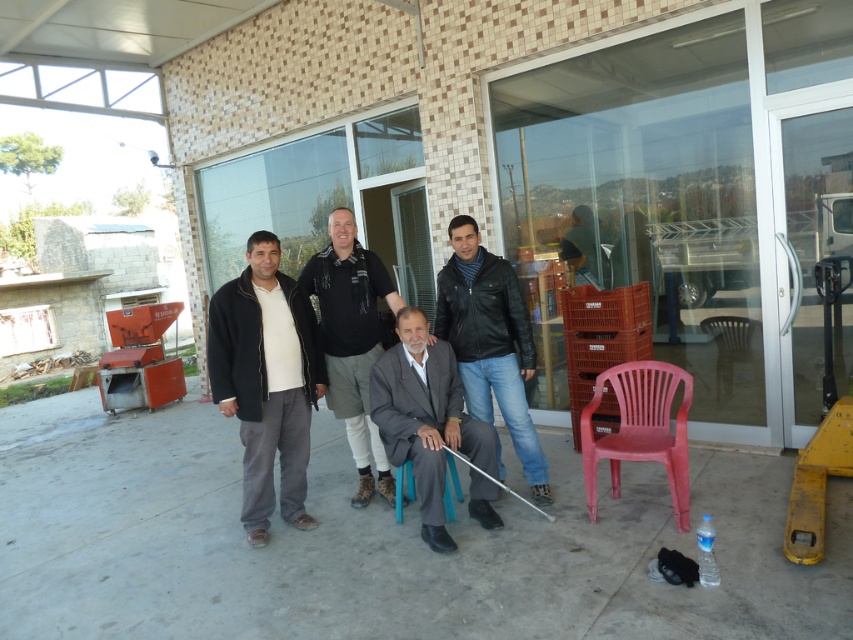
You are a photographer trying to capture a group photo of the dark gray suit at center and the black leather jacket at center. Since you want to ensure both subjects are in focus, you need to know which one is closer to the camera. Can you determine which is closer?

The dark gray suit at center is shorter than the black leather jacket at center, so the dark gray suit at center is closer to the camera.

You are standing in front of the building and want to locate the leather jacket at center. Based on the coordinates provided, where exactly should you look to find it?

The leather jacket at center is located at point 0.534 on the x axis and 0.576 on the y axis.